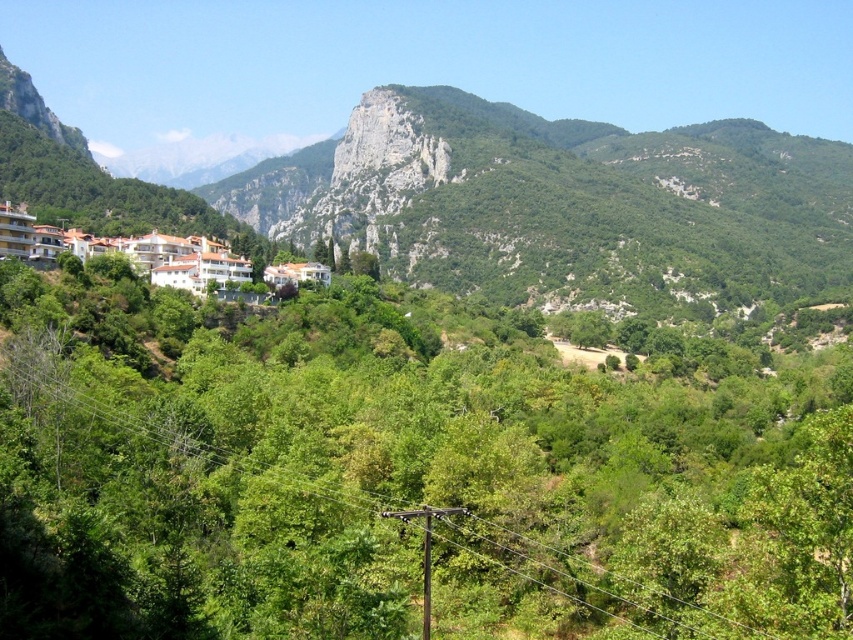
Does green leafy tree at upper center have a lesser height compared to white glossy buildings at lower left?

No.

Does point (314, 332) come in front of point (202, 269)?

No.

Locate an element on the screen. Image resolution: width=853 pixels, height=640 pixels. green leafy tree at upper center is located at coordinates (403, 470).

Is point (668, 252) closer to camera compared to point (218, 276)?

No, (668, 252) is behind (218, 276).

Find the location of a particular element. This screenshot has height=640, width=853. green rocky mountain at upper center is located at coordinates (564, 204).

Between green leafy tree at upper center and green rocky mountain at upper center, which one appears on the right side from the viewer's perspective?

Positioned to the right is green rocky mountain at upper center.

Identify the location of green leafy tree at upper center. (403, 470).